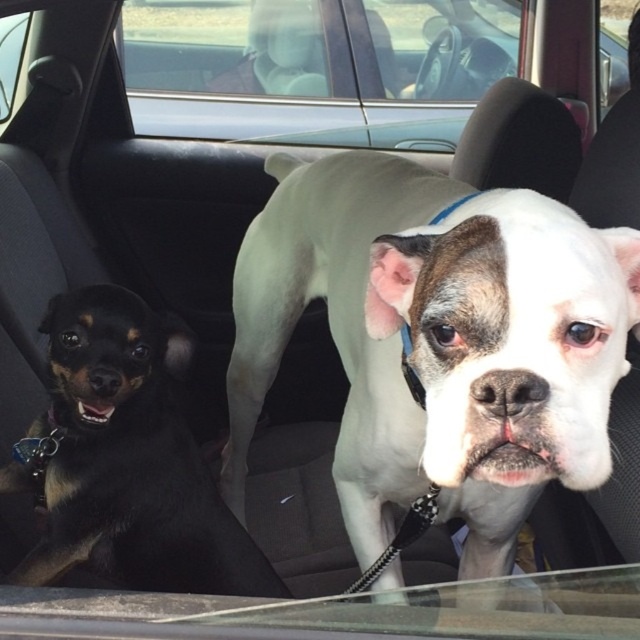
Is white smooth dog at center shorter than black smooth dog at left?

No.

Does white smooth dog at center appear on the left side of black smooth dog at left?

Incorrect, white smooth dog at center is not on the left side of black smooth dog at left.

The width and height of the screenshot is (640, 640). I want to click on white smooth dog at center, so click(x=436, y=340).